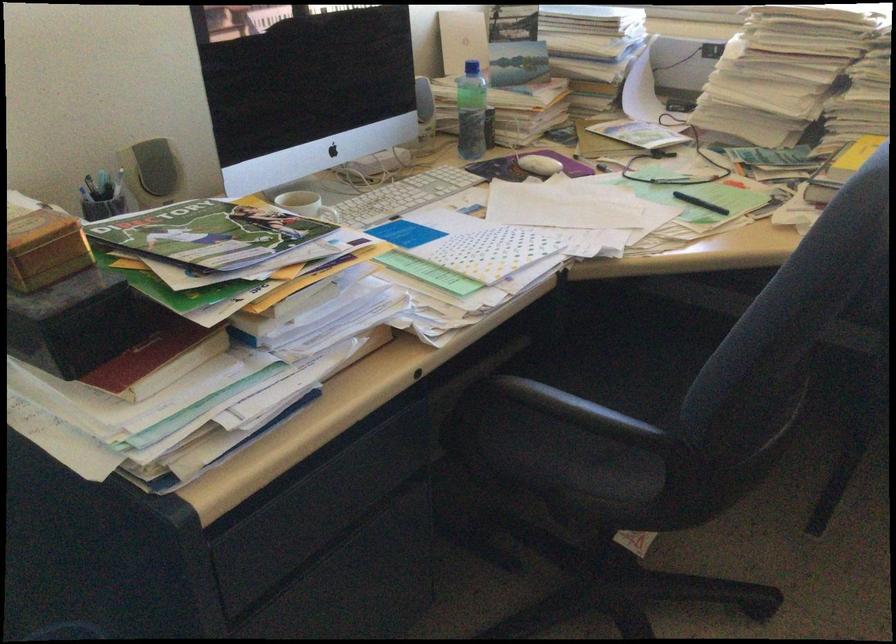
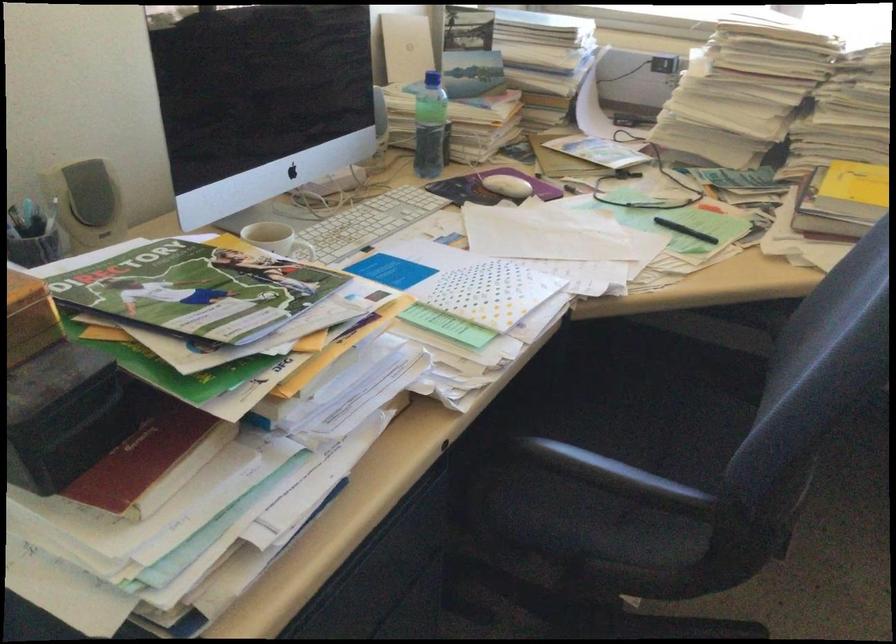
Where in the second image is the point corresponding to pixel 648 143 from the first image?

(610, 166)